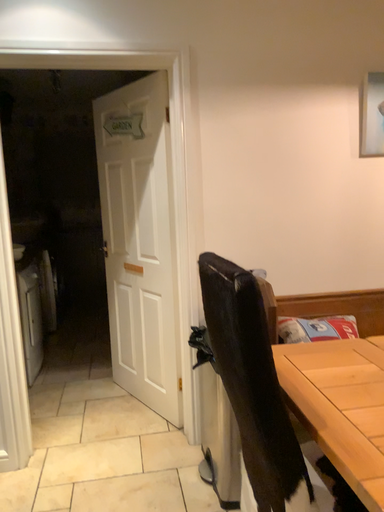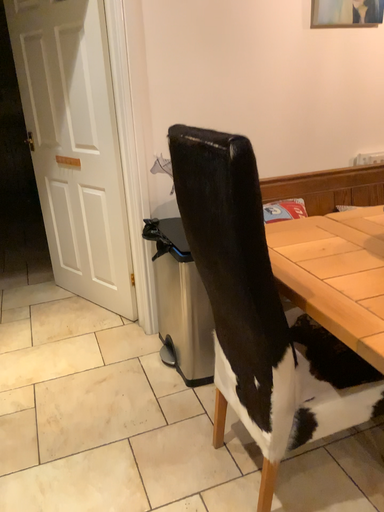
Question: How did the camera likely rotate when shooting the video?

Choices:
 (A) rotated downward
 (B) rotated upward

Answer: (A)